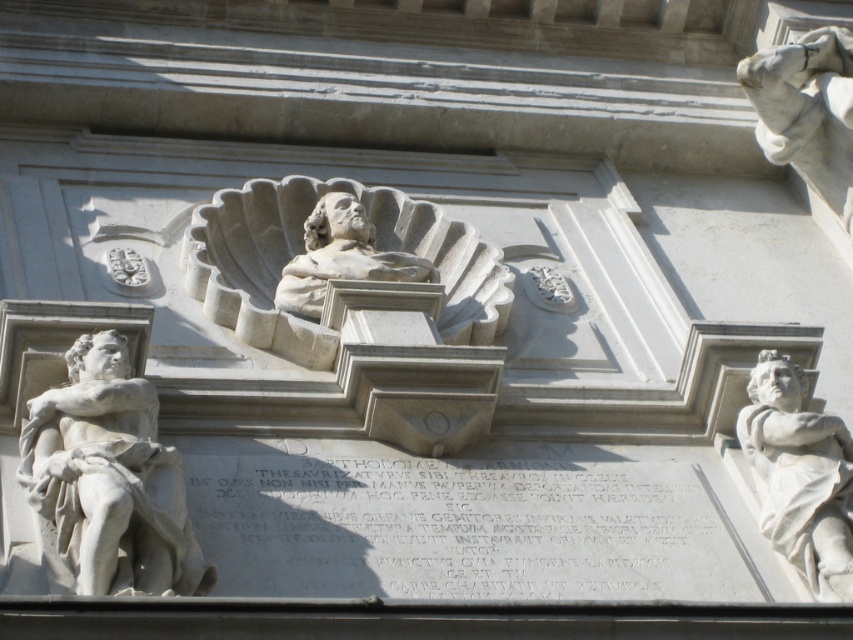
Question: Based on their relative distances, which object is nearer to the white marble bust at center?

Choices:
 (A) white marble statue at left
 (B) white marble hand at upper right

Answer: (B)

Question: Which object appears farthest from the camera in this image?

Choices:
 (A) white marble statue at right
 (B) white marble statue at left
 (C) white marble hand at upper right
 (D) white marble bust at center

Answer: (C)

Question: Can you confirm if white marble statue at left is positioned to the right of white marble bust at center?

Choices:
 (A) no
 (B) yes

Answer: (A)

Question: Does white marble statue at left appear over white marble bust at center?

Choices:
 (A) no
 (B) yes

Answer: (A)

Question: Is white marble statue at right positioned behind white marble hand at upper right?

Choices:
 (A) yes
 (B) no

Answer: (B)

Question: Which of the following is the farthest from the observer?

Choices:
 (A) [x=802, y=472]
 (B) [x=125, y=372]
 (C) [x=796, y=157]

Answer: (C)